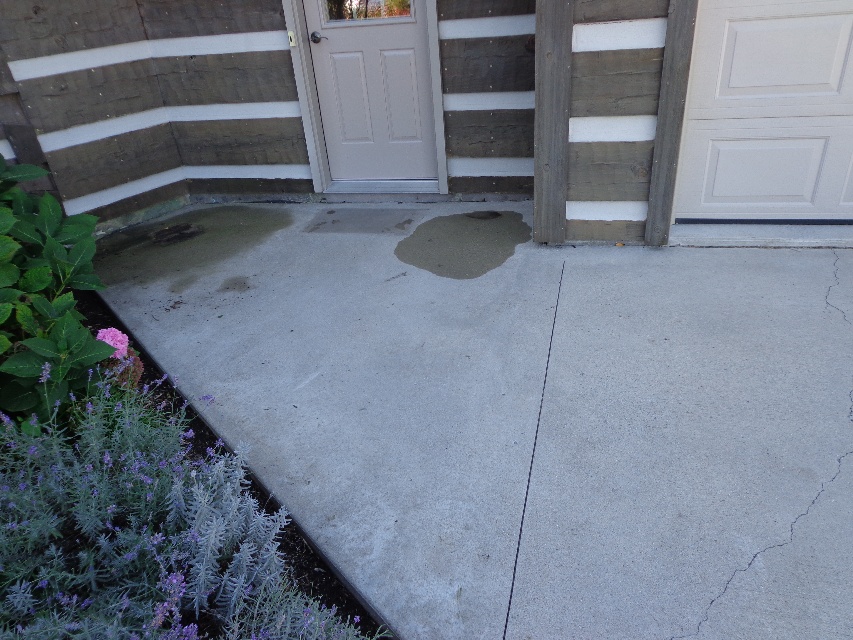
Question: Which object appears farthest from the camera in this image?

Choices:
 (A) gray concrete crack at center
 (B) purple fuzzy plant at lower left
 (C) concrete wet patch at center
 (D) white matte door at center

Answer: (D)

Question: Which object is closer to the camera taking this photo?

Choices:
 (A) purple fuzzy plant at lower left
 (B) concrete wet patch at center

Answer: (A)

Question: Can you confirm if concrete wet patch at center is bigger than purple fuzzy plant at lower left?

Choices:
 (A) no
 (B) yes

Answer: (B)

Question: Which object is closer to the camera taking this photo?

Choices:
 (A) white painted wood garage door at right
 (B) green leafy plant at lower left

Answer: (B)

Question: Is gray concrete pavement at lower left positioned behind green leafy plant at lower left?

Choices:
 (A) yes
 (B) no

Answer: (B)

Question: Is white matte door at center above green leafy plant at lower left?

Choices:
 (A) yes
 (B) no

Answer: (A)